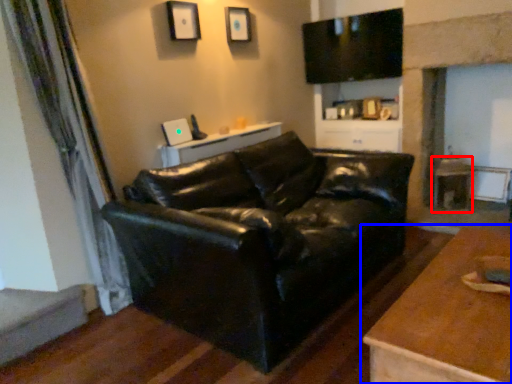
Question: Which object appears farthest to the camera in this image, side table (highlighted by a red box) or table (highlighted by a blue box)?

Choices:
 (A) side table
 (B) table

Answer: (A)